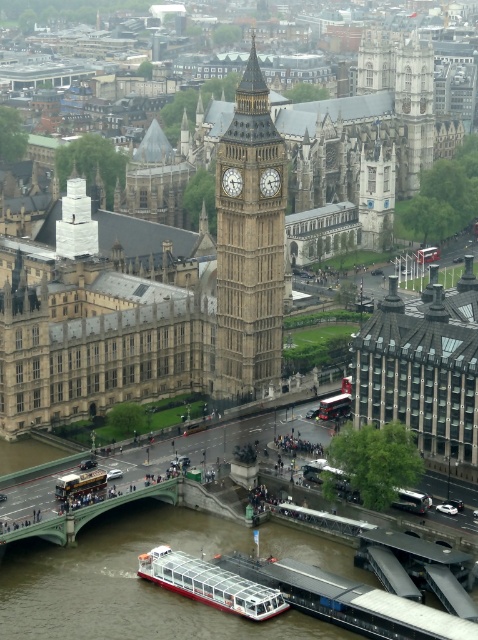
You are a tourist standing on the riverbank and see the golden stone building at center and the golden stone clock tower at center. Which one is closer to your left side?

The golden stone building at center is to the left of golden stone clock tower at center, so it is closer to your left side.

From the picture: You are a tourist standing in front of the golden stone building at center and the golden stone clock tower at center. Which one is closer to the ground?

The golden stone building at center is closer to the ground because it is located below the golden stone clock tower at center.